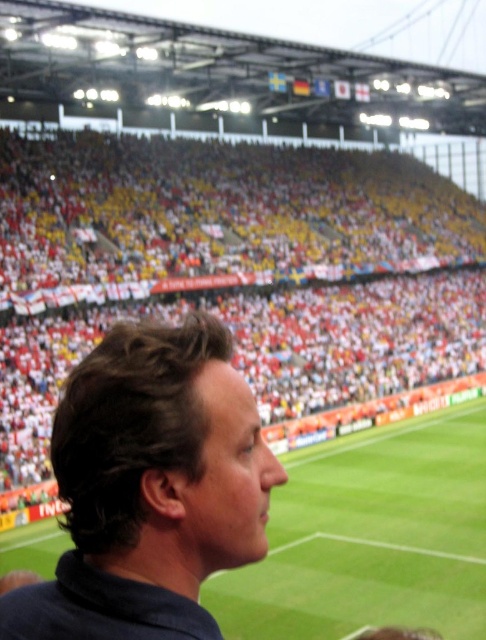
Does yellow fabric crowd at upper left appear on the right side of dark brown hair at center?

Correct, you'll find yellow fabric crowd at upper left to the right of dark brown hair at center.

Does yellow fabric crowd at upper left appear over dark brown hair at center?

Correct, yellow fabric crowd at upper left is located above dark brown hair at center.

Identify the location of yellow fabric crowd at upper left. (243, 264).